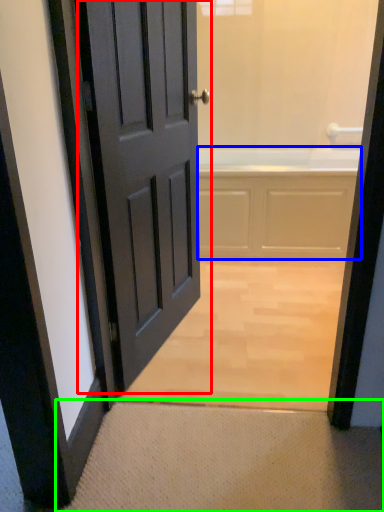
Question: Considering the real-world distances, which object is farthest from door (highlighted by a red box)? bath (highlighted by a blue box) or doormat (highlighted by a green box)?

Choices:
 (A) bath
 (B) doormat

Answer: (A)